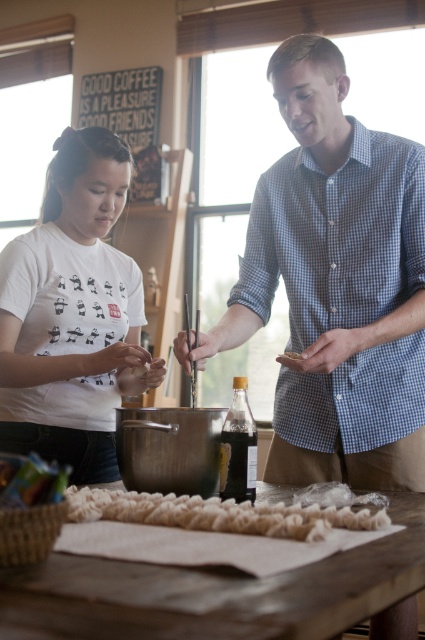
Can you confirm if blue checkered shirt at center is shorter than white printed t-shirt at left?

No.

Can you confirm if blue checkered shirt at center is smaller than white printed t-shirt at left?

No.

Between point (422, 182) and point (48, 401), which one is positioned in front?

Point (422, 182)

Locate an element on the screen. The width and height of the screenshot is (425, 640). blue checkered shirt at center is located at coordinates (336, 284).

Is point (289, 122) in front of point (292, 356)?

No, it is behind (292, 356).

Who is taller, blue checkered shirt at center or brown crumbly food at center?

blue checkered shirt at center is taller.

Is point (323, 38) closer to viewer compared to point (294, 353)?

That is False.

The width and height of the screenshot is (425, 640). What are the coordinates of `blue checkered shirt at center` in the screenshot? It's located at (336, 284).

Is wooden table at center to the right of brown crumbly food at center from the viewer's perspective?

Incorrect, wooden table at center is not on the right side of brown crumbly food at center.

Can you confirm if wooden table at center is positioned to the left of brown crumbly food at center?

Yes, wooden table at center is to the left of brown crumbly food at center.

Between point (193, 589) and point (299, 355), which one is positioned in front?

Point (193, 589) is in front.

Find the location of `wooden table at center`. wooden table at center is located at coordinates (215, 593).